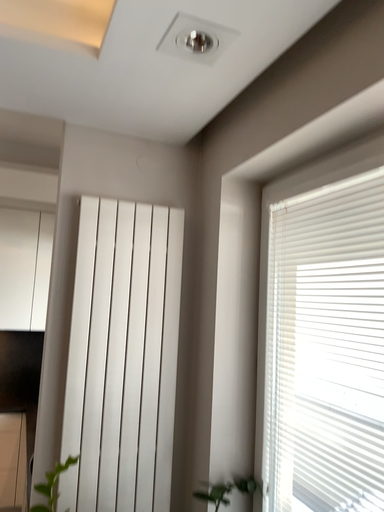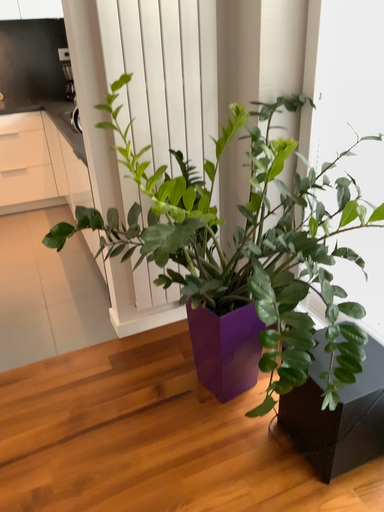
Question: Which way did the camera rotate in the video?

Choices:
 (A) rotated downward
 (B) rotated upward

Answer: (A)